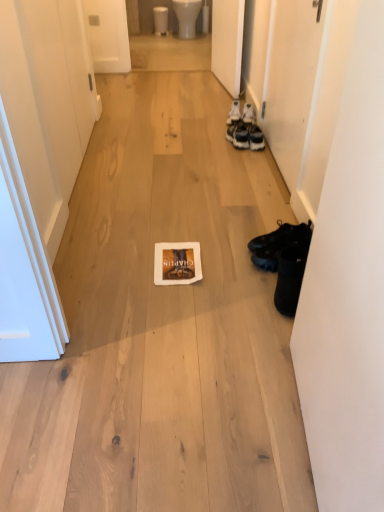
Question: Considering their positions, is white leather sneakers at right, the third footwear in the front-to-back sequence, located in front of or behind white glossy toilet bowl at upper center, which is the first toilet bowl from right to left?

Choices:
 (A) behind
 (B) front

Answer: (B)

Question: Is white leather sneakers at right, the third footwear in the front-to-back sequence, spatially inside white glossy toilet bowl at upper center, which is the 2th toilet bowl from left to right, or outside of it?

Choices:
 (A) inside
 (B) outside

Answer: (B)

Question: Estimate the real-world distances between objects in this image. Which object is closer to the black leather shoes at right, the 2th footwear from the back?

Choices:
 (A) white matte door at right, acting as the third door starting from the left
 (B) white matte door at upper left, the 1th door from the left
 (C) white leather sneakers at right, the third footwear in the front-to-back sequence
 (D) black leather shoes at lower right, which is counted as the third footwear, starting from the top
 (E) white matte door at upper right, marked as the 2th door in a right-to-left arrangement

Answer: (D)

Question: Which of these objects is positioned farthest from the white glossy toilet bowl at upper center, placed as the first toilet bowl when sorted from left to right?

Choices:
 (A) white glossy toilet bowl at upper center, which is the first toilet bowl from right to left
 (B) black leather shoes at lower right, arranged as the 1th footwear when ordered from the bottom
 (C) white leather sneakers at right, which is the third footwear from bottom to top
 (D) black leather shoes at right, acting as the 2th footwear starting from the bottom
 (E) white matte door at right, acting as the third door starting from the left

Answer: (B)